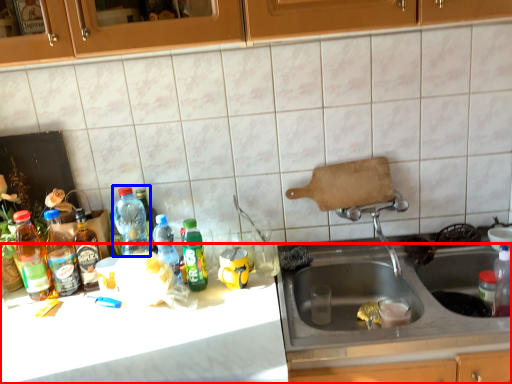
Question: Which object is closer to the camera taking this photo, counter top (highlighted by a red box) or bottle (highlighted by a blue box)?

Choices:
 (A) counter top
 (B) bottle

Answer: (A)